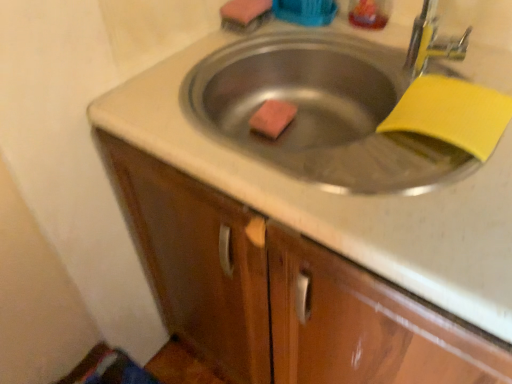
The height and width of the screenshot is (384, 512). What do you see at coordinates (282, 292) in the screenshot?
I see `wooden cabinet at center` at bounding box center [282, 292].

What is the approximate width of pink sponge at center, which appears as the second soap when viewed from the top?

4.39 inches.

The image size is (512, 384). Find the location of `pink sponge at upper center, the second soap positioned from the bottom`. pink sponge at upper center, the second soap positioned from the bottom is located at coordinates point(244,12).

Is pink sponge at upper center, the second soap positioned from the bottom, to the left of translucent plastic liquid at upper right from the viewer's perspective?

Yes.

From the image's perspective, does pink sponge at upper center, which appears as the first soap when viewed from the top, appear lower than translucent plastic liquid at upper right?

Yes.

How many degrees apart are the facing directions of pink sponge at upper center, which appears as the first soap when viewed from the top, and translucent plastic liquid at upper right?

The angular difference between pink sponge at upper center, which appears as the first soap when viewed from the top, and translucent plastic liquid at upper right is 90 degrees.

Is pink sponge at upper center, the second soap positioned from the bottom, facing towards translucent plastic liquid at upper right?

No, pink sponge at upper center, the second soap positioned from the bottom, is not turned towards translucent plastic liquid at upper right.

Is pink sponge at center, arranged as the 1th soap when ordered from the bottom, facing away from pink sponge at upper center, the second soap positioned from the bottom?

No, pink sponge at center, arranged as the 1th soap when ordered from the bottom,'s orientation is not away from pink sponge at upper center, the second soap positioned from the bottom.

From the picture: Which is in front, pink sponge at center, arranged as the 1th soap when ordered from the bottom, or pink sponge at upper center, which appears as the first soap when viewed from the top?

pink sponge at center, arranged as the 1th soap when ordered from the bottom.

Is pink sponge at center, arranged as the 1th soap when ordered from the bottom, not close to pink sponge at upper center, the second soap positioned from the bottom?

No, pink sponge at center, arranged as the 1th soap when ordered from the bottom, is not far away from pink sponge at upper center, the second soap positioned from the bottom.

Considering the sizes of objects pink sponge at center, arranged as the 1th soap when ordered from the bottom, and pink sponge at upper center, which appears as the first soap when viewed from the top, in the image provided, who is shorter, pink sponge at center, arranged as the 1th soap when ordered from the bottom, or pink sponge at upper center, which appears as the first soap when viewed from the top,?

With less height is pink sponge at center, arranged as the 1th soap when ordered from the bottom.

Can you tell me how much wooden cabinet at center and pink sponge at center, arranged as the 1th soap when ordered from the bottom, differ in facing direction?

The facing directions of wooden cabinet at center and pink sponge at center, arranged as the 1th soap when ordered from the bottom, are 5.26 degrees apart.

Is wooden cabinet at center facing towards pink sponge at center, arranged as the 1th soap when ordered from the bottom?

Yes, wooden cabinet at center is facing pink sponge at center, arranged as the 1th soap when ordered from the bottom.

Is wooden cabinet at center wider or thinner than pink sponge at center, arranged as the 1th soap when ordered from the bottom?

In the image, wooden cabinet at center appears to be wider than pink sponge at center, arranged as the 1th soap when ordered from the bottom.

Considering the relative sizes of wooden cabinet at center and pink sponge at center, which appears as the second soap when viewed from the top, in the image provided, is wooden cabinet at center taller than pink sponge at center, which appears as the second soap when viewed from the top,?

Yes, wooden cabinet at center is taller than pink sponge at center, which appears as the second soap when viewed from the top.

From the image's perspective, is pink sponge at center, which appears as the second soap when viewed from the top, located above or below wooden cabinet at center?

From the image's perspective, pink sponge at center, which appears as the second soap when viewed from the top, appears above wooden cabinet at center.

Is pink sponge at center, arranged as the 1th soap when ordered from the bottom, inside the boundaries of wooden cabinet at center, or outside?

pink sponge at center, arranged as the 1th soap when ordered from the bottom, is spatially positioned inside wooden cabinet at center.

Who is smaller, pink sponge at center, which appears as the second soap when viewed from the top, or wooden cabinet at center?

pink sponge at center, which appears as the second soap when viewed from the top.

From a real-world perspective, between pink sponge at center, which appears as the second soap when viewed from the top, and wooden cabinet at center, who is vertically higher?

From a 3D spatial view, pink sponge at center, which appears as the second soap when viewed from the top, is above.

Considering the relative sizes of pink sponge at upper center, which appears as the first soap when viewed from the top, and pink sponge at center, arranged as the 1th soap when ordered from the bottom, in the image provided, is pink sponge at upper center, which appears as the first soap when viewed from the top, wider than pink sponge at center, arranged as the 1th soap when ordered from the bottom,?

Incorrect, the width of pink sponge at upper center, which appears as the first soap when viewed from the top, does not surpass that of pink sponge at center, arranged as the 1th soap when ordered from the bottom.

Would you say pink sponge at upper center, the second soap positioned from the bottom, contains pink sponge at center, which appears as the second soap when viewed from the top?

No, pink sponge at center, which appears as the second soap when viewed from the top, is not a part of pink sponge at upper center, the second soap positioned from the bottom.

How much distance is there between pink sponge at upper center, the second soap positioned from the bottom, and pink sponge at center, arranged as the 1th soap when ordered from the bottom?

pink sponge at upper center, the second soap positioned from the bottom, is 8.64 inches from pink sponge at center, arranged as the 1th soap when ordered from the bottom.

Which of these two, pink sponge at upper center, the second soap positioned from the bottom, or pink sponge at center, which appears as the second soap when viewed from the top, is smaller?

pink sponge at center, which appears as the second soap when viewed from the top.

From a real-world perspective, starting from the translucent plastic liquid at upper right, which soap is the 2nd one below it? Please provide its 2D coordinates.

[(272, 118)]

In the image, is translucent plastic liquid at upper right on the left side or the right side of pink sponge at center, which appears as the second soap when viewed from the top?

translucent plastic liquid at upper right is to the right of pink sponge at center, which appears as the second soap when viewed from the top.

From a real-world perspective, who is located lower, translucent plastic liquid at upper right or pink sponge at center, which appears as the second soap when viewed from the top?

From a 3D spatial view, pink sponge at center, which appears as the second soap when viewed from the top, is below.

In the scene shown: Which is in front, pink sponge at center, arranged as the 1th soap when ordered from the bottom, or translucent plastic liquid at upper right?

translucent plastic liquid at upper right is more forward.

Is pink sponge at center, which appears as the second soap when viewed from the top, positioned beyond the bounds of translucent plastic liquid at upper right?

Indeed, pink sponge at center, which appears as the second soap when viewed from the top, is completely outside translucent plastic liquid at upper right.

Does point (261, 107) appear closer or farther from the camera than point (365, 8)?

Point (261, 107) is positioned farther from the camera compared to point (365, 8).

Can you confirm if pink sponge at center, arranged as the 1th soap when ordered from the bottom, is bigger than translucent plastic liquid at upper right?

No.

This screenshot has height=384, width=512. I want to click on liquid located on the right of pink sponge at upper center, which appears as the first soap when viewed from the top, so click(x=369, y=13).

The image size is (512, 384). Identify the location of soap behind the pink sponge at center, which appears as the second soap when viewed from the top. (244, 12).

When comparing their distances from translucent plastic liquid at upper right, does pink sponge at upper center, which appears as the first soap when viewed from the top, or wooden cabinet at center seem closer?

pink sponge at upper center, which appears as the first soap when viewed from the top.

Considering their positions, is translucent plastic liquid at upper right positioned closer to pink sponge at upper center, the second soap positioned from the bottom, than wooden cabinet at center?

translucent plastic liquid at upper right is closer to pink sponge at upper center, the second soap positioned from the bottom.

Estimate the real-world distances between objects in this image. Which object is further from pink sponge at center, arranged as the 1th soap when ordered from the bottom, wooden cabinet at center or translucent plastic liquid at upper right?

wooden cabinet at center lies further to pink sponge at center, arranged as the 1th soap when ordered from the bottom, than the other object.

When comparing their distances from translucent plastic liquid at upper right, does pink sponge at upper center, which appears as the first soap when viewed from the top, or pink sponge at center, arranged as the 1th soap when ordered from the bottom, seem closer?

pink sponge at upper center, which appears as the first soap when viewed from the top.

From the image, which object appears to be nearer to pink sponge at upper center, which appears as the first soap when viewed from the top, translucent plastic liquid at upper right or pink sponge at center, which appears as the second soap when viewed from the top?

Based on the image, pink sponge at center, which appears as the second soap when viewed from the top, appears to be nearer to pink sponge at upper center, which appears as the first soap when viewed from the top.

When comparing their distances from wooden cabinet at center, does pink sponge at center, arranged as the 1th soap when ordered from the bottom, or translucent plastic liquid at upper right seem closer?

The object closer to wooden cabinet at center is pink sponge at center, arranged as the 1th soap when ordered from the bottom.

Looking at this image, estimate the real-world distances between objects in this image. Which object is closer to wooden cabinet at center, pink sponge at upper center, the second soap positioned from the bottom, or pink sponge at center, arranged as the 1th soap when ordered from the bottom?

The object closer to wooden cabinet at center is pink sponge at center, arranged as the 1th soap when ordered from the bottom.

Based on their spatial positions, is pink sponge at center, arranged as the 1th soap when ordered from the bottom, or pink sponge at upper center, which appears as the first soap when viewed from the top, further from wooden cabinet at center?

The object further to wooden cabinet at center is pink sponge at upper center, which appears as the first soap when viewed from the top.

In order to click on soap between wooden cabinet at center and pink sponge at upper center, which appears as the first soap when viewed from the top, in the front-back direction in this screenshot , I will do `click(272, 118)`.

Identify the location of soap between translucent plastic liquid at upper right and pink sponge at center, arranged as the 1th soap when ordered from the bottom, from top to bottom. This screenshot has width=512, height=384. (244, 12).